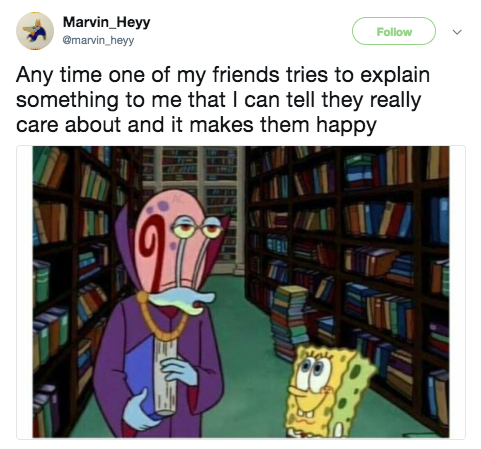
Find the location of `stack of books`. stack of books is located at coordinates (285, 325).